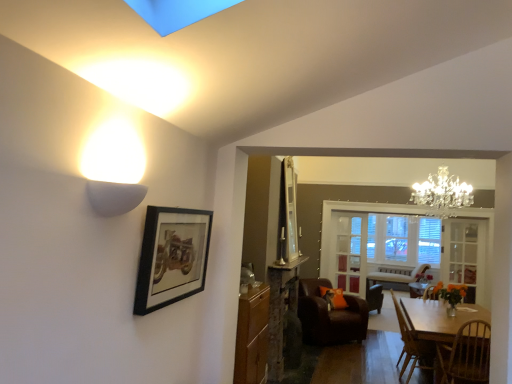
Question: Is wooden dining table at lower right turned away from clear glass door at center, the 2th glass door in the left-to-right sequence?

Choices:
 (A) yes
 (B) no

Answer: (B)

Question: Is wooden dining table at lower right at the left side of clear glass door at center, acting as the first glass door starting from the right?

Choices:
 (A) yes
 (B) no

Answer: (A)

Question: Is wooden dining table at lower right wider than clear glass door at center, which ranks as the 2th glass door in back-to-front order?

Choices:
 (A) no
 (B) yes

Answer: (B)

Question: Is wooden dining table at lower right in front of clear glass door at center, the 2th glass door in the left-to-right sequence?

Choices:
 (A) no
 (B) yes

Answer: (B)

Question: Is wooden dining table at lower right outside clear glass door at center, which is counted as the 1th glass door, starting from the front?

Choices:
 (A) no
 (B) yes

Answer: (B)

Question: Is the position of wooden dining table at lower right more distant than that of clear glass door at center, which is counted as the 1th glass door, starting from the front?

Choices:
 (A) no
 (B) yes

Answer: (A)

Question: Is wooden dining table at lower right oriented towards wooden cabinet at center?

Choices:
 (A) yes
 (B) no

Answer: (B)

Question: Does wooden dining table at lower right come in front of wooden cabinet at center?

Choices:
 (A) no
 (B) yes

Answer: (A)

Question: From the image's perspective, is wooden dining table at lower right on top of wooden cabinet at center?

Choices:
 (A) yes
 (B) no

Answer: (B)

Question: Is wooden dining table at lower right wider than wooden cabinet at center?

Choices:
 (A) yes
 (B) no

Answer: (A)

Question: Is wooden dining table at lower right located outside wooden cabinet at center?

Choices:
 (A) yes
 (B) no

Answer: (A)

Question: Considering the relative sizes of wooden dining table at lower right and wooden cabinet at center in the image provided, is wooden dining table at lower right taller than wooden cabinet at center?

Choices:
 (A) no
 (B) yes

Answer: (A)

Question: Is clear glass window at center positioned with its back to wooden dining table at lower right?

Choices:
 (A) no
 (B) yes

Answer: (A)